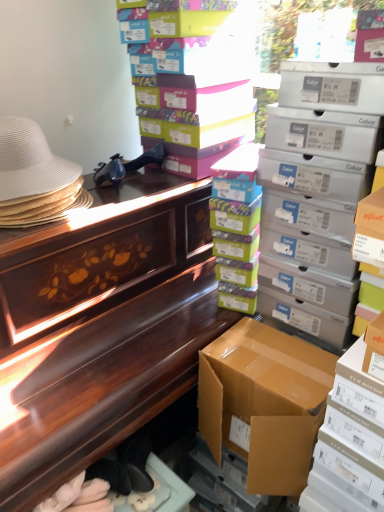
Question: From a real-world perspective, is matte cardboard box at upper right, which is counted as the 4th box, starting from the bottom, positioned above or below white woven hat at left?

Choices:
 (A) below
 (B) above

Answer: (A)

Question: Is point tap(276, 179) positioned closer to the camera than point tap(13, 124)?

Choices:
 (A) closer
 (B) farther

Answer: (B)

Question: Which of these objects is positioned farthest from the brown cardboard box at lower right, positioned as the fourth box in top-to-bottom order?

Choices:
 (A) brown cardboard box at right, which is the first box from bottom to top
 (B) white woven hat at left
 (C) wooden desk at upper left
 (D) matte cardboard box at upper right, marked as the second box in a top-to-bottom arrangement
 (E) multicolored cardboard box at upper center, the fifth box in the bottom-to-top sequence

Answer: (B)

Question: Estimate the real-world distances between objects in this image. Which object is closer to the multicolored cardboard boxes at center, acting as the 3th box starting from the bottom?

Choices:
 (A) white woven hat at left
 (B) brown cardboard box at right, which is the first box from bottom to top
 (C) multicolored cardboard box at upper center, the fifth box in the bottom-to-top sequence
 (D) wooden desk at upper left
 (E) brown cardboard box at lower right, the 2th box in the bottom-to-top sequence

Answer: (C)